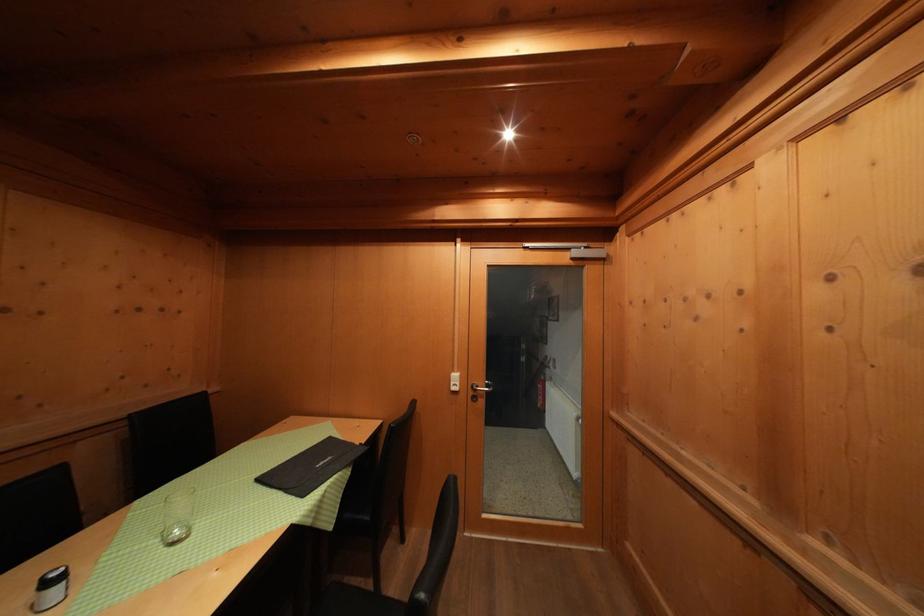
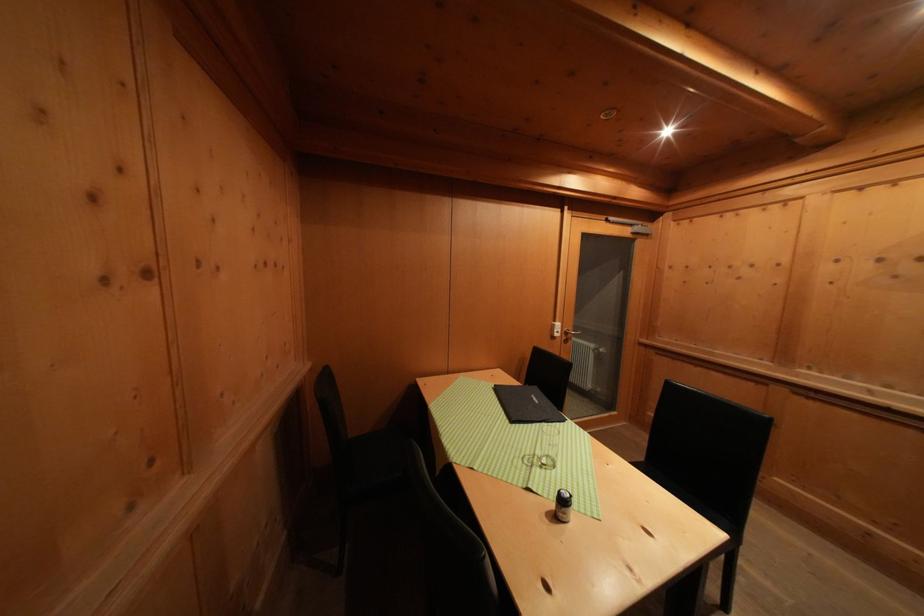
In the second image, find the point that corresponds to (462,381) in the first image.

(564, 330)